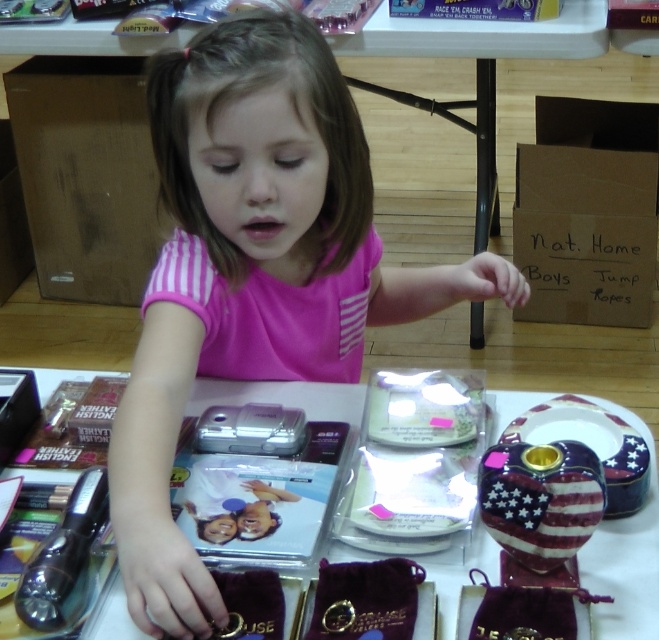
Can you confirm if metallic silver camera at center is positioned to the left of american flag-patterned ceramic vase at lower right?

Indeed, metallic silver camera at center is positioned on the left side of american flag-patterned ceramic vase at lower right.

Does metallic silver camera at center come behind american flag-patterned ceramic vase at lower right?

That is True.

The width and height of the screenshot is (659, 640). What do you see at coordinates (625, 557) in the screenshot?
I see `metallic silver camera at center` at bounding box center [625, 557].

This screenshot has width=659, height=640. I want to click on metallic silver camera at center, so click(x=625, y=557).

Does point (571, 548) come behind point (100, 484)?

No.

Between point (513, 538) and point (69, 616), which one is positioned behind?

The point (69, 616) is behind.

Who is more forward, [579,516] or [67,532]?

Point [579,516] is more forward.

Locate an element on the screen. american flag-patterned ceramic vase at lower right is located at coordinates (540, 499).

Is point (138, 356) farther from camera compared to point (214, 422)?

No, it is not.

Who is positioned more to the right, pink fabric child at center or silver metallic camera at center?

From the viewer's perspective, pink fabric child at center appears more on the right side.

Is point (389, 273) in front of point (204, 433)?

That is False.

The width and height of the screenshot is (659, 640). What are the coordinates of `pink fabric child at center` in the screenshot? It's located at (252, 272).